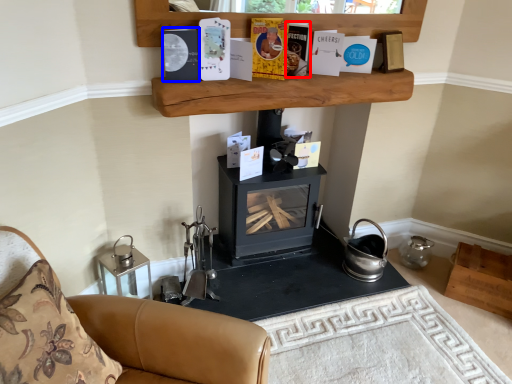
Question: Which object appears farthest to the camera in this image, paperback book (highlighted by a red box) or paperback book (highlighted by a blue box)?

Choices:
 (A) paperback book
 (B) paperback book

Answer: (A)